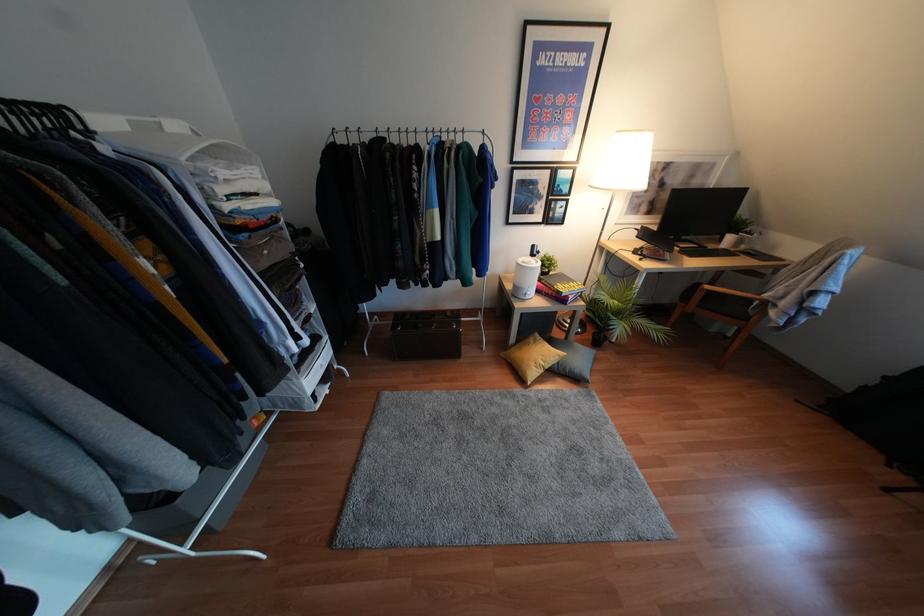
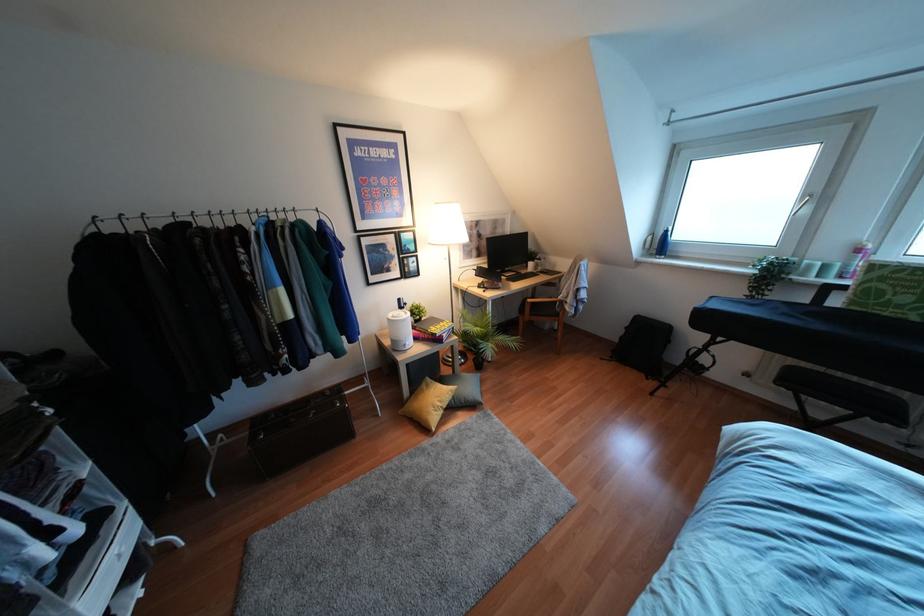
Locate, in the second image, the point that corresponds to pixel 864 387 in the first image.

(621, 337)